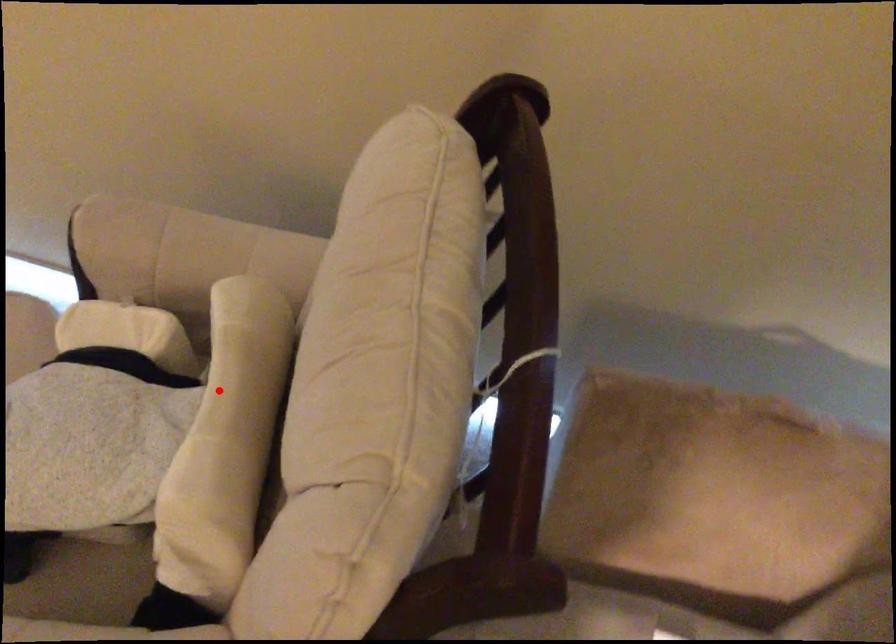
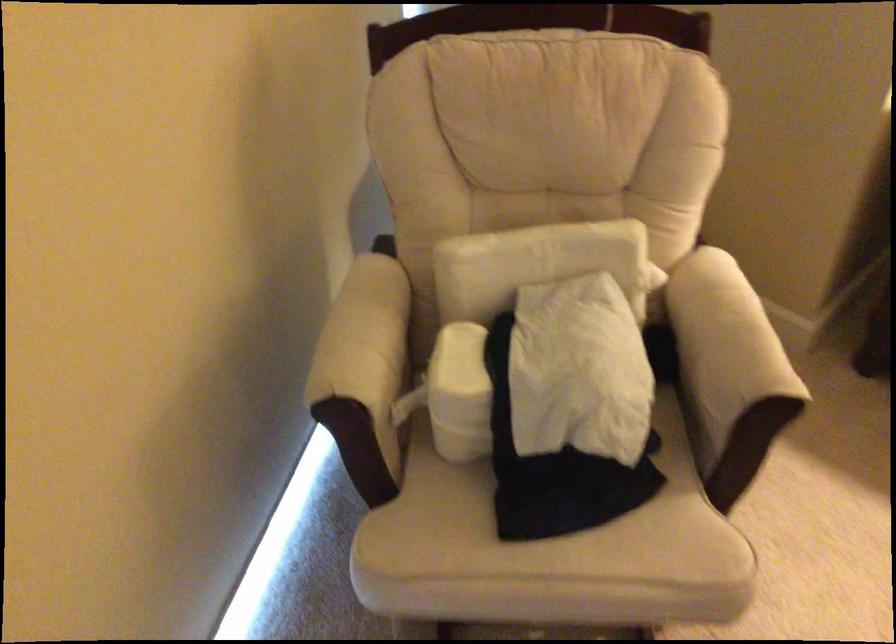
Question: I am providing you with two images of the same scene from different viewpoints. A red point is shown in image1. For the corresponding object point in image2, is it positioned nearer or farther from the camera?

Choices:
 (A) Nearer
 (B) Farther

Answer: (B)